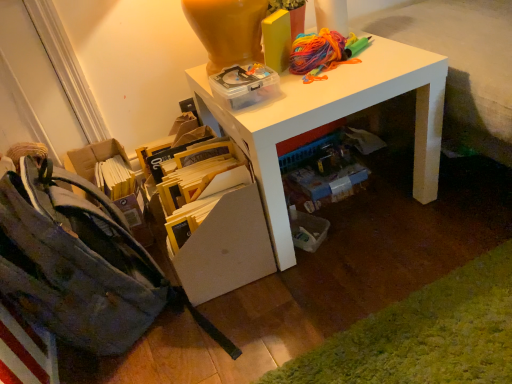
Question: From a real-world perspective, is yellow cardboard book at lower center below floral canvas shoulder bag at lower left?

Choices:
 (A) yes
 (B) no

Answer: (A)

Question: Could you tell me if yellow cardboard book at lower center is turned towards floral canvas shoulder bag at lower left?

Choices:
 (A) yes
 (B) no

Answer: (A)

Question: From a real-world perspective, is yellow cardboard book at lower center over floral canvas shoulder bag at lower left?

Choices:
 (A) yes
 (B) no

Answer: (B)

Question: Does yellow cardboard book at lower center come behind floral canvas shoulder bag at lower left?

Choices:
 (A) yes
 (B) no

Answer: (A)

Question: Considering the relative sizes of yellow cardboard book at lower center and floral canvas shoulder bag at lower left in the image provided, is yellow cardboard book at lower center bigger than floral canvas shoulder bag at lower left?

Choices:
 (A) yes
 (B) no

Answer: (B)

Question: In the image, is white glossy desk at upper center on the left side or the right side of yellow cardboard at lower left?

Choices:
 (A) left
 (B) right

Answer: (B)

Question: Choose the correct answer: Is white glossy desk at upper center inside yellow cardboard at lower left or outside it?

Choices:
 (A) outside
 (B) inside

Answer: (A)

Question: From their relative heights in the image, would you say white glossy desk at upper center is taller or shorter than yellow cardboard at lower left?

Choices:
 (A) tall
 (B) short

Answer: (A)

Question: Relative to yellow cardboard at lower left, is white glossy desk at upper center in front or behind?

Choices:
 (A) front
 (B) behind

Answer: (B)

Question: In the image, is floral canvas shoulder bag at lower left on the left side or the right side of yellow cardboard book at lower center?

Choices:
 (A) right
 (B) left

Answer: (B)

Question: In terms of width, does floral canvas shoulder bag at lower left look wider or thinner when compared to yellow cardboard book at lower center?

Choices:
 (A) wide
 (B) thin

Answer: (A)

Question: Would you say floral canvas shoulder bag at lower left is inside or outside yellow cardboard book at lower center?

Choices:
 (A) outside
 (B) inside

Answer: (A)

Question: Considering their positions, is floral canvas shoulder bag at lower left located in front of or behind yellow cardboard book at lower center?

Choices:
 (A) front
 (B) behind

Answer: (A)

Question: Considering the positions of white glossy desk at upper center and floral canvas shoulder bag at lower left in the image, is white glossy desk at upper center wider or thinner than floral canvas shoulder bag at lower left?

Choices:
 (A) thin
 (B) wide

Answer: (B)

Question: Considering their positions, is white glossy desk at upper center located in front of or behind floral canvas shoulder bag at lower left?

Choices:
 (A) front
 (B) behind

Answer: (B)